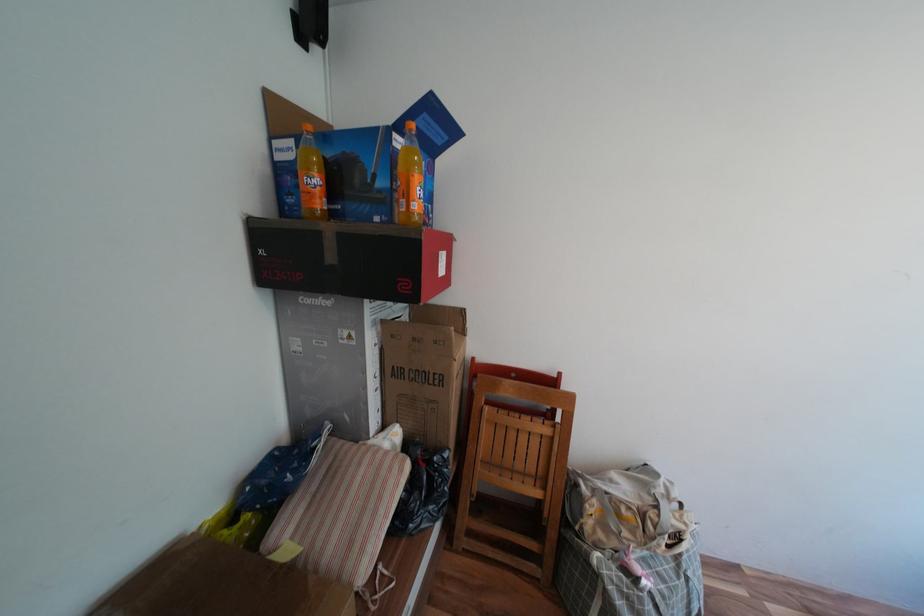
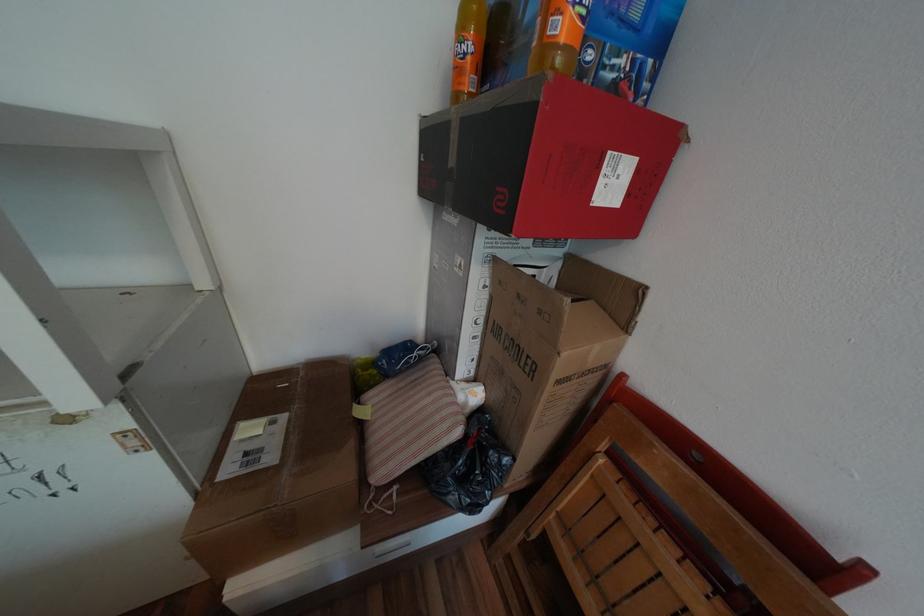
Locate, in the second image, the point that corresponds to point 444,342 in the first image.

(550, 312)